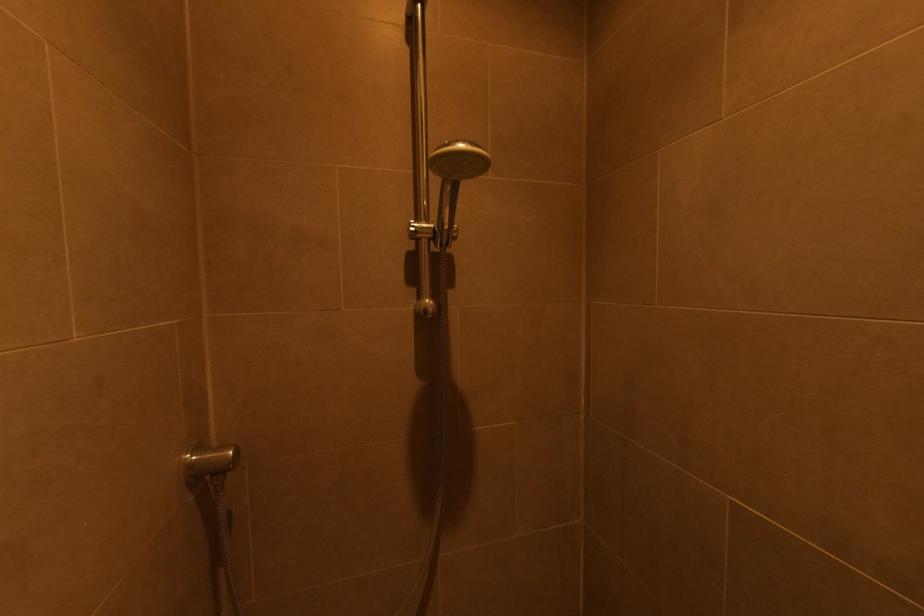
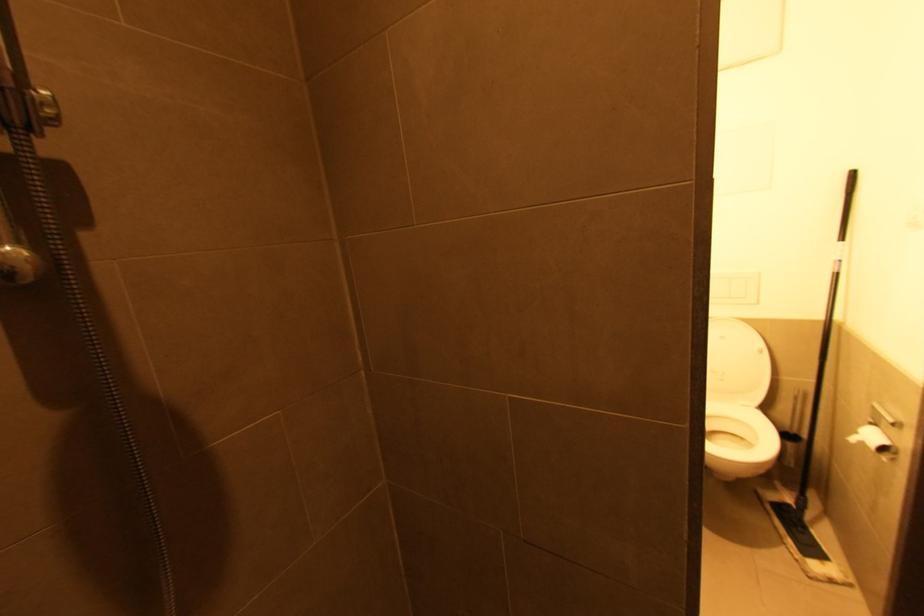
Question: Based on the continuous images, in which direction is the camera rotating? Reply with the corresponding letter.

Choices:
 (A) Left
 (B) Right
 (C) Up
 (D) Down

Answer: (B)